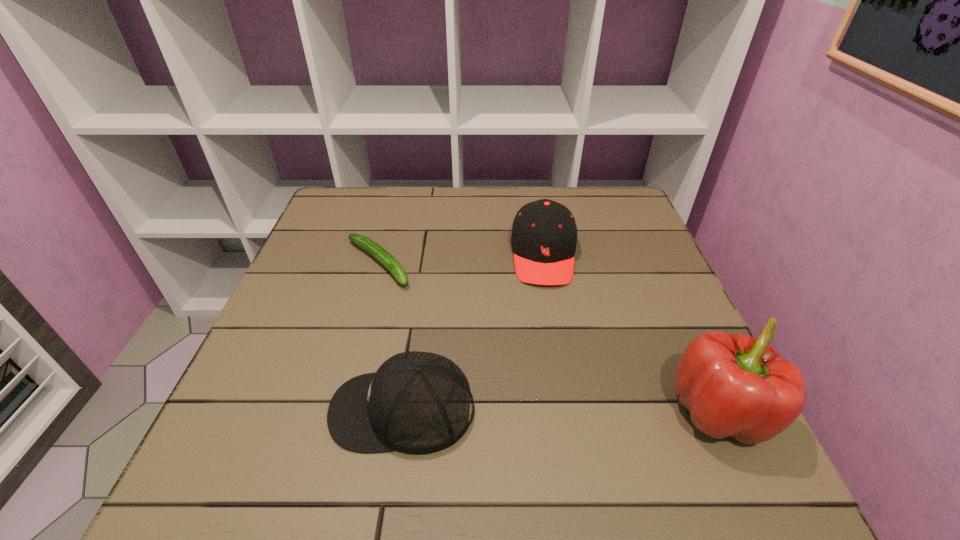
Identify the location of object that is at the near right corner. The height and width of the screenshot is (540, 960). (736, 385).

This screenshot has height=540, width=960. In the image, there is a desktop. Find the location of `vacant space at the far edge`. vacant space at the far edge is located at coordinates (491, 208).

Identify the location of vacant area at the near edge of the desktop. The width and height of the screenshot is (960, 540). (518, 406).

Locate an element on the screen. The image size is (960, 540). free space at the left edge of the desktop is located at coordinates (354, 278).

Find the location of a particular element. The height and width of the screenshot is (540, 960). vacant space at the right edge of the desktop is located at coordinates [x=651, y=313].

Image resolution: width=960 pixels, height=540 pixels. Find the location of `vacant region at the far left corner of the desktop`. vacant region at the far left corner of the desktop is located at coordinates [x=339, y=214].

Where is `unoccupied area between the second object from right to left and the tallest object`? unoccupied area between the second object from right to left and the tallest object is located at coordinates (632, 334).

Locate an element on the screen. The image size is (960, 540). empty location between the left cap and the shortest object is located at coordinates (390, 336).

The width and height of the screenshot is (960, 540). I want to click on empty space that is in between the right cap and the zucchini, so click(461, 259).

This screenshot has width=960, height=540. Identify the location of free space between the zucchini and the right cap. (461, 259).